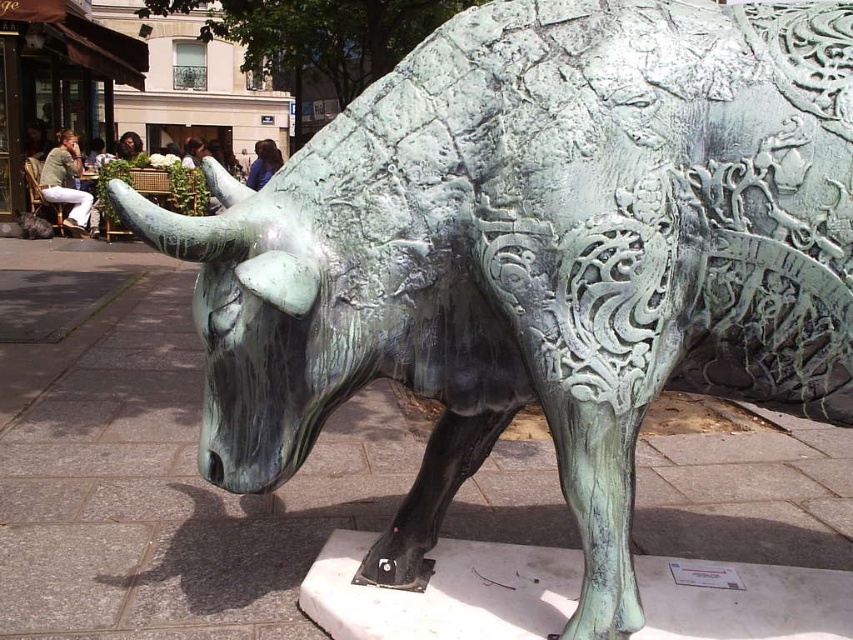
Describe the element at coordinates (65, 180) in the screenshot. Image resolution: width=853 pixels, height=640 pixels. I see `green cotton shirt at left` at that location.

Is green cotton shirt at left to the right of dark brown hair at upper center from the viewer's perspective?

In fact, green cotton shirt at left is to the left of dark brown hair at upper center.

Between point (61, 164) and point (117, 152), which one is positioned behind?

Positioned behind is point (117, 152).

Locate an element on the screen. This screenshot has width=853, height=640. green cotton shirt at left is located at coordinates (65, 180).

Between blue fabric at center and dark brown hair at upper center, which one appears on the left side from the viewer's perspective?

From the viewer's perspective, dark brown hair at upper center appears more on the left side.

Between blue fabric at center and dark brown hair at upper center, which one has more height?

With more height is dark brown hair at upper center.

Where is `blue fabric at center`? This screenshot has height=640, width=853. blue fabric at center is located at coordinates (263, 163).

Between green cotton shirt at left and blue fabric at center, which one appears on the left side from the viewer's perspective?

green cotton shirt at left

Is green cotton shirt at left closer to the viewer compared to blue fabric at center?

No, it is not.

This screenshot has height=640, width=853. Describe the element at coordinates (65, 180) in the screenshot. I see `green cotton shirt at left` at that location.

This screenshot has width=853, height=640. In order to click on green cotton shirt at left in this screenshot , I will do `click(65, 180)`.